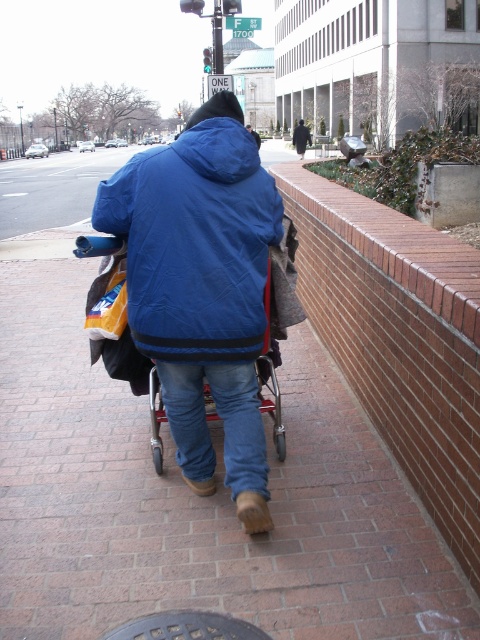
Is point (147, 182) more distant than point (251, 129)?

That is False.

Is matte blue jacket at center further to camera compared to blue fleece jacket at center?

No.

Between point (143, 179) and point (260, 138), which one is positioned in front?

Point (143, 179) is more forward.

You are a GUI agent. You are given a task and a screenshot of the screen. Output one action in this format:
    pyautogui.click(x=<x>, y=<y>)
    Task: Click on the matte blue jacket at center
    
    Given the screenshot: What is the action you would take?
    pyautogui.click(x=194, y=243)

Where is `dark gray metallic manhole cover at lower center`? The image size is (480, 640). dark gray metallic manhole cover at lower center is located at coordinates (187, 627).

Describe the element at coordinates (187, 627) in the screenshot. This screenshot has height=640, width=480. I see `dark gray metallic manhole cover at lower center` at that location.

The image size is (480, 640). Find the location of `dark gray metallic manhole cover at lower center`. dark gray metallic manhole cover at lower center is located at coordinates (187, 627).

Is dark gray metallic manhole cover at lower center above dark brown leather jacket at center?

No, dark gray metallic manhole cover at lower center is not above dark brown leather jacket at center.

Can you confirm if dark gray metallic manhole cover at lower center is positioned below dark brown leather jacket at center?

Yes, dark gray metallic manhole cover at lower center is below dark brown leather jacket at center.

The width and height of the screenshot is (480, 640). I want to click on dark gray metallic manhole cover at lower center, so click(187, 627).